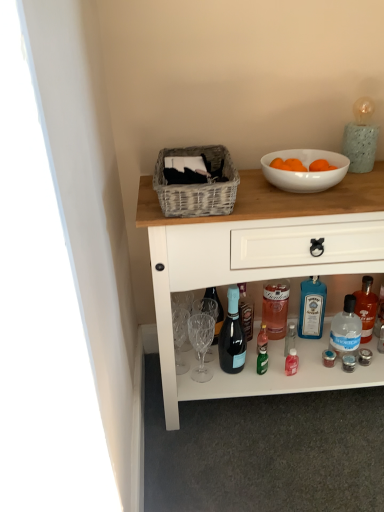
The image size is (384, 512). Describe the element at coordinates (312, 308) in the screenshot. I see `blue glass bottle at lower center, the third bottle from the right` at that location.

In the scene shown: In order to face transparent plastic bottle at lower right, the second bottle viewed from the left, should I rotate leftwards or rightwards?

Rotate right and turn 20.055 degrees.

Locate an element on the screen. matte black wine bottle at center is located at coordinates (232, 336).

The width and height of the screenshot is (384, 512). Describe the element at coordinates (366, 308) in the screenshot. I see `clear plastic bottle at lower right, the first bottle positioned from the right` at that location.

What do you see at coordinates (305, 172) in the screenshot?
I see `white glossy bowl at upper right` at bounding box center [305, 172].

You are a GUI agent. You are given a task and a screenshot of the screen. Output one action in this format:
    pyautogui.click(x=<x>, y=<y>)
    Task: Click on the white wood desk at center
    The image size is (384, 512).
    Given the screenshot: What is the action you would take?
    pyautogui.click(x=263, y=269)

In the scene shown: Considering the positions of objects transparent plastic bottle at lower right, the second bottle viewed from the left, and white glossy bowl at upper right in the image provided, who is in front, transparent plastic bottle at lower right, the second bottle viewed from the left, or white glossy bowl at upper right?

Positioned in front is white glossy bowl at upper right.

Does transparent plastic bottle at lower right, the 2th bottle in the right-to-left sequence, turn towards white glossy bowl at upper right?

No, transparent plastic bottle at lower right, the 2th bottle in the right-to-left sequence, is not aimed at white glossy bowl at upper right.

Can you confirm if transparent plastic bottle at lower right, the second bottle viewed from the left, is wider than white glossy bowl at upper right?

Incorrect, the width of transparent plastic bottle at lower right, the second bottle viewed from the left, does not surpass that of white glossy bowl at upper right.

Can you tell me how much transparent plastic bottle at lower right, the 2th bottle in the right-to-left sequence, and white glossy bowl at upper right differ in facing direction?

3.59 degrees.

Could you tell me if blue glass bottle at lower center, marked as the 1th bottle in a left-to-right arrangement, is facing woven gray picnic basket at upper center?

No.

Which point is more forward, (x=311, y=319) or (x=166, y=184)?

The point (x=166, y=184) is more forward.

Who is smaller, blue glass bottle at lower center, the third bottle from the right, or woven gray picnic basket at upper center?

blue glass bottle at lower center, the third bottle from the right, is smaller.

Is clear plastic bottle at lower right, which appears as the 3th bottle when viewed from the left, surrounded by white wood desk at center?

Yes.

Considering the relative sizes of white wood desk at center and clear plastic bottle at lower right, which appears as the 3th bottle when viewed from the left, in the image provided, is white wood desk at center taller than clear plastic bottle at lower right, which appears as the 3th bottle when viewed from the left,?

Indeed, white wood desk at center has a greater height compared to clear plastic bottle at lower right, which appears as the 3th bottle when viewed from the left.

From the image's perspective, which is above, white wood desk at center or clear plastic bottle at lower right, the first bottle positioned from the right?

white wood desk at center is shown above in the image.

Is white wood desk at center next to clear plastic bottle at lower right, which appears as the 3th bottle when viewed from the left, and touching it?

No, white wood desk at center is not with clear plastic bottle at lower right, which appears as the 3th bottle when viewed from the left.

Does blue glass bottle at lower center, the third bottle from the right, have a larger size compared to white glossy bowl at upper right?

Yes.

From a real-world perspective, is blue glass bottle at lower center, marked as the 1th bottle in a left-to-right arrangement, physically above white glossy bowl at upper right?

No.

Is blue glass bottle at lower center, the third bottle from the right, oriented away from white glossy bowl at upper right?

blue glass bottle at lower center, the third bottle from the right, does not have its back to white glossy bowl at upper right.

Considering the sizes of objects blue glass bottle at lower center, marked as the 1th bottle in a left-to-right arrangement, and white glossy bowl at upper right in the image provided, who is taller, blue glass bottle at lower center, marked as the 1th bottle in a left-to-right arrangement, or white glossy bowl at upper right?

blue glass bottle at lower center, marked as the 1th bottle in a left-to-right arrangement.

In the scene shown: Is white glossy bowl at upper right at the right side of woven gray picnic basket at upper center?

Indeed, white glossy bowl at upper right is positioned on the right side of woven gray picnic basket at upper center.

Looking at the image, does white glossy bowl at upper right seem bigger or smaller compared to woven gray picnic basket at upper center?

white glossy bowl at upper right is smaller than woven gray picnic basket at upper center.

From the image's perspective, who appears lower, white glossy bowl at upper right or woven gray picnic basket at upper center?

woven gray picnic basket at upper center is shown below in the image.

From a real-world perspective, is woven gray picnic basket at upper center physically below transparent plastic bottle at lower right, the 2th bottle in the right-to-left sequence?

No.

Consider the image. Considering the sizes of objects woven gray picnic basket at upper center and transparent plastic bottle at lower right, the second bottle viewed from the left, in the image provided, who is taller, woven gray picnic basket at upper center or transparent plastic bottle at lower right, the second bottle viewed from the left,?

transparent plastic bottle at lower right, the second bottle viewed from the left, is taller.

Is transparent plastic bottle at lower right, the 2th bottle in the right-to-left sequence, at the back of woven gray picnic basket at upper center?

No, woven gray picnic basket at upper center's orientation is not away from transparent plastic bottle at lower right, the 2th bottle in the right-to-left sequence.

Is point (213, 162) positioned after point (330, 339)?

That is False.

Is white wood desk at center positioned before woven gray picnic basket at upper center?

That is False.

Would you say white wood desk at center is outside woven gray picnic basket at upper center?

Yes.

From their relative heights in the image, would you say white wood desk at center is taller or shorter than woven gray picnic basket at upper center?

In the image, white wood desk at center appears to be taller than woven gray picnic basket at upper center.

This screenshot has height=512, width=384. What are the coordinates of `the 1st bottle behind when counting from the white glossy bowl at upper right` in the screenshot? It's located at (346, 329).

The width and height of the screenshot is (384, 512). In order to click on the 1st bottle counting from the right side of the woven gray picnic basket at upper center in this screenshot , I will do `click(312, 308)`.

Looking at the image, which one is located closer to white glossy bowl at upper right, matte black wine bottle at center or clear plastic bottle at lower right, the first bottle positioned from the right?

clear plastic bottle at lower right, the first bottle positioned from the right, lies closer to white glossy bowl at upper right than the other object.

Looking at the image, which one is located closer to blue glass bottle at lower center, marked as the 1th bottle in a left-to-right arrangement, matte black wine bottle at center or white glossy bowl at upper right?

matte black wine bottle at center lies closer to blue glass bottle at lower center, marked as the 1th bottle in a left-to-right arrangement, than the other object.

From the picture: Estimate the real-world distances between objects in this image. Which object is further from clear plastic bottle at lower right, the first bottle positioned from the right, woven gray picnic basket at upper center or matte black wine bottle at center?

woven gray picnic basket at upper center.

Considering their positions, is transparent plastic bottle at lower right, the 2th bottle in the right-to-left sequence, positioned further to white wood desk at center than blue glass bottle at lower center, the third bottle from the right?

The object further to white wood desk at center is transparent plastic bottle at lower right, the 2th bottle in the right-to-left sequence.

From the picture: From the image, which object appears to be farther from transparent plastic bottle at lower right, the 2th bottle in the right-to-left sequence, blue glass bottle at lower center, marked as the 1th bottle in a left-to-right arrangement, or white wood desk at center?

The object further to transparent plastic bottle at lower right, the 2th bottle in the right-to-left sequence, is white wood desk at center.

Looking at the image, which one is located further to white wood desk at center, transparent plastic bottle at lower right, the 2th bottle in the right-to-left sequence, or clear plastic bottle at lower right, the first bottle positioned from the right?

clear plastic bottle at lower right, the first bottle positioned from the right, lies further to white wood desk at center than the other object.

Which object lies nearer to the anchor point clear plastic bottle at lower right, the first bottle positioned from the right, blue glass bottle at lower center, the third bottle from the right, or matte black wine bottle at center?

blue glass bottle at lower center, the third bottle from the right, is positioned closer to the anchor clear plastic bottle at lower right, the first bottle positioned from the right.

Considering their positions, is blue glass bottle at lower center, the third bottle from the right, positioned closer to transparent plastic bottle at lower right, the 2th bottle in the right-to-left sequence, than matte black wine bottle at center?

blue glass bottle at lower center, the third bottle from the right, is closer to transparent plastic bottle at lower right, the 2th bottle in the right-to-left sequence.

You are a GUI agent. You are given a task and a screenshot of the screen. Output one action in this format:
    pyautogui.click(x=<x>, y=<y>)
    Task: Click on the wine bottle between white wood desk at center and blue glass bottle at lower center, the third bottle from the right, along the z-axis
    The image size is (384, 512).
    Given the screenshot: What is the action you would take?
    pyautogui.click(x=232, y=336)

This screenshot has width=384, height=512. I want to click on bottle between white wood desk at center and clear plastic bottle at lower right, the first bottle positioned from the right, along the z-axis, so (x=346, y=329).

Where is `picnic basket between white glossy bowl at upper right and blue glass bottle at lower center, the third bottle from the right, from top to bottom`? Image resolution: width=384 pixels, height=512 pixels. picnic basket between white glossy bowl at upper right and blue glass bottle at lower center, the third bottle from the right, from top to bottom is located at coordinates (197, 186).

This screenshot has height=512, width=384. In order to click on desk that lies between white glossy bowl at upper right and blue glass bottle at lower center, the third bottle from the right, from top to bottom in this screenshot , I will do `click(263, 269)`.